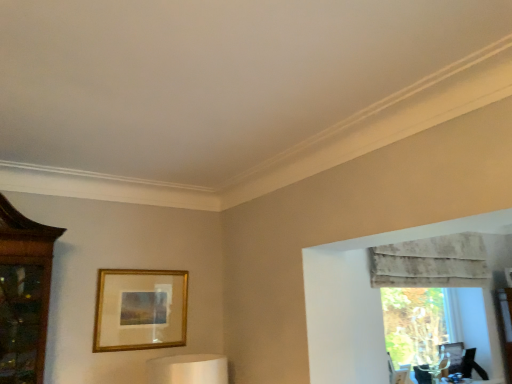
Question: Considering the positions of gold metallic picture frame at center and transparent glass vase at right in the image, is gold metallic picture frame at center bigger or smaller than transparent glass vase at right?

Choices:
 (A) big
 (B) small

Answer: (B)

Question: Looking at their shapes, would you say gold metallic picture frame at center is wider or thinner than transparent glass vase at right?

Choices:
 (A) wide
 (B) thin

Answer: (B)

Question: Which object is positioned closest to the transparent glass vase at right?

Choices:
 (A) gold metallic picture frame at center
 (B) textured beige curtain at upper right

Answer: (B)

Question: Based on their relative distances, which object is nearer to the transparent glass vase at right?

Choices:
 (A) gold metallic picture frame at center
 (B) textured beige curtain at upper right

Answer: (B)